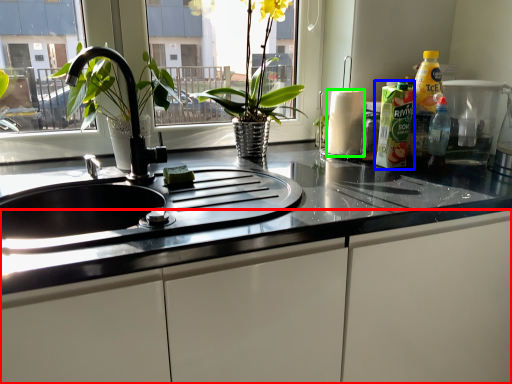
Question: Which object is the farthest from cabinetry (highlighted by a red box)? Choose among these: cleaning product (highlighted by a blue box) or paper towel (highlighted by a green box).

Choices:
 (A) cleaning product
 (B) paper towel

Answer: (B)